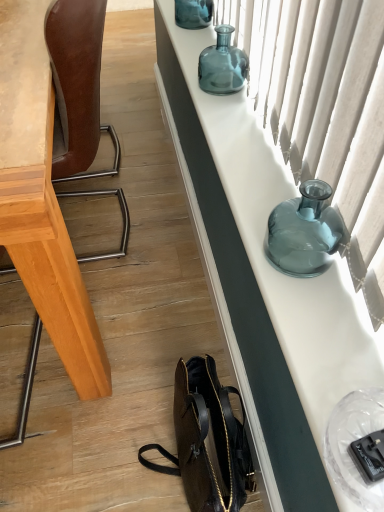
Question: From a real-world perspective, is brown leather chair at left physically below translucent glass vase at upper center, the second bottle when ordered from bottom to top?

Choices:
 (A) yes
 (B) no

Answer: (A)

Question: Is brown leather chair at left positioned with its back to translucent glass vase at upper center, the second bottle when ordered from bottom to top?

Choices:
 (A) no
 (B) yes

Answer: (B)

Question: Can you confirm if brown leather chair at left is taller than translucent glass vase at upper center, the second bottle in the back-to-front sequence?

Choices:
 (A) yes
 (B) no

Answer: (A)

Question: Is brown leather chair at left next to translucent glass vase at upper center, the second bottle when ordered from bottom to top?

Choices:
 (A) yes
 (B) no

Answer: (B)

Question: Is translucent glass vase at upper center, which ranks as the 2th bottle in top-to-bottom order, surrounded by brown leather chair at left?

Choices:
 (A) no
 (B) yes

Answer: (A)

Question: Is translucent glass vase at upper right, positioned as the 1th bottle in front-to-back order, in front of or behind teal glass vase at upper center, the 1th bottle in the top-to-bottom sequence, in the image?

Choices:
 (A) front
 (B) behind

Answer: (A)

Question: Is point (329, 193) positioned closer to the camera than point (208, 24)?

Choices:
 (A) farther
 (B) closer

Answer: (B)

Question: Considering the positions of translucent glass vase at upper right, the 3th bottle viewed from the top, and teal glass vase at upper center, marked as the first bottle in a back-to-front arrangement, in the image, is translucent glass vase at upper right, the 3th bottle viewed from the top, taller or shorter than teal glass vase at upper center, marked as the first bottle in a back-to-front arrangement,?

Choices:
 (A) short
 (B) tall

Answer: (B)

Question: In terms of width, does translucent glass vase at upper right, the 3th bottle viewed from the top, look wider or thinner when compared to teal glass vase at upper center, the third bottle when ordered from bottom to top?

Choices:
 (A) wide
 (B) thin

Answer: (A)

Question: Considering the positions of point (221, 148) and point (294, 24), is point (221, 148) closer or farther from the camera than point (294, 24)?

Choices:
 (A) closer
 (B) farther

Answer: (B)

Question: From the image's perspective, relative to translucent fabric curtain at upper right, is matte glass vase at upper right above or below?

Choices:
 (A) above
 (B) below

Answer: (B)

Question: Looking at the image, does matte glass vase at upper right seem bigger or smaller compared to translucent fabric curtain at upper right?

Choices:
 (A) small
 (B) big

Answer: (A)

Question: Considering the positions of matte glass vase at upper right and translucent fabric curtain at upper right in the image, is matte glass vase at upper right wider or thinner than translucent fabric curtain at upper right?

Choices:
 (A) thin
 (B) wide

Answer: (B)

Question: In terms of size, does translucent glass vase at upper center, the second bottle in the back-to-front sequence, appear bigger or smaller than teal glass vase at upper center, the third bottle when ordered from bottom to top?

Choices:
 (A) small
 (B) big

Answer: (A)

Question: Considering the positions of point (243, 66) and point (180, 10), is point (243, 66) closer or farther from the camera than point (180, 10)?

Choices:
 (A) closer
 (B) farther

Answer: (A)